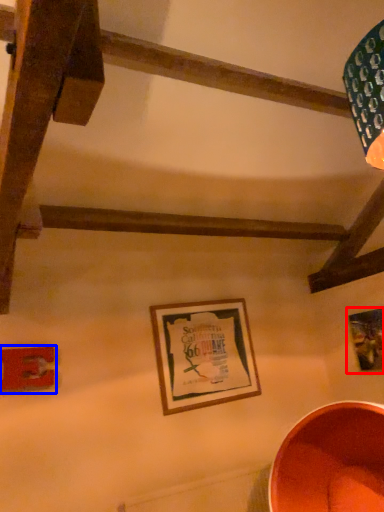
Question: Among these objects, which one is nearest to the camera, picture frame (highlighted by a red box) or picture frame (highlighted by a blue box)?

Choices:
 (A) picture frame
 (B) picture frame

Answer: (B)